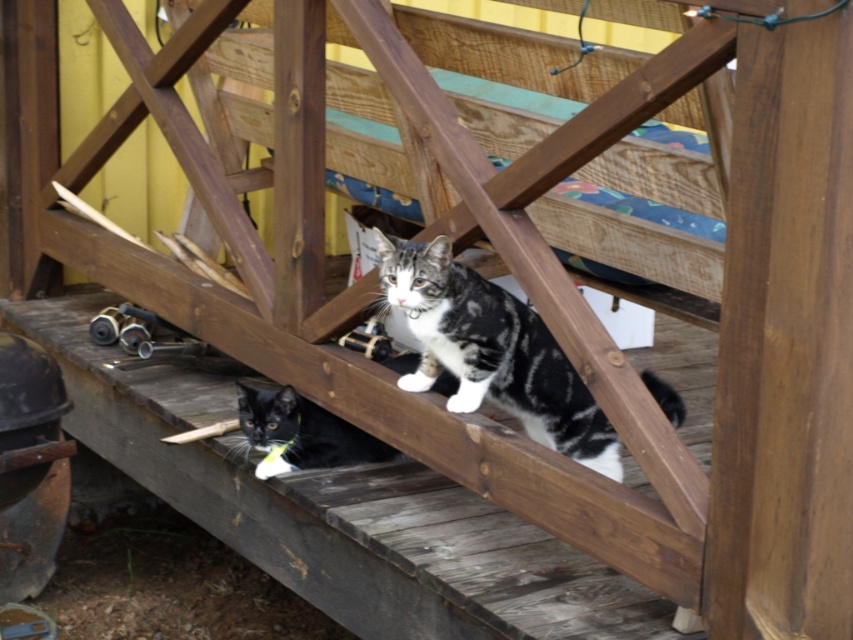
Does tabby fur cat at center have a smaller size compared to black fur cat at lower left?

No.

Between tabby fur cat at center and black fur cat at lower left, which one is positioned higher?

tabby fur cat at center is higher up.

Is point (610, 442) behind point (308, 412)?

No, (610, 442) is in front of (308, 412).

Locate an element on the screen. Image resolution: width=853 pixels, height=640 pixels. tabby fur cat at center is located at coordinates (491, 349).